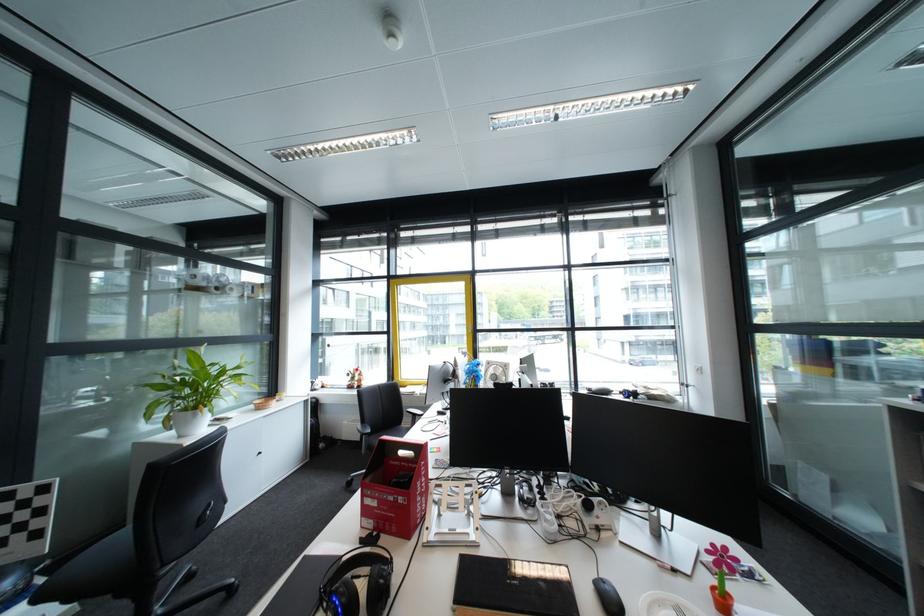
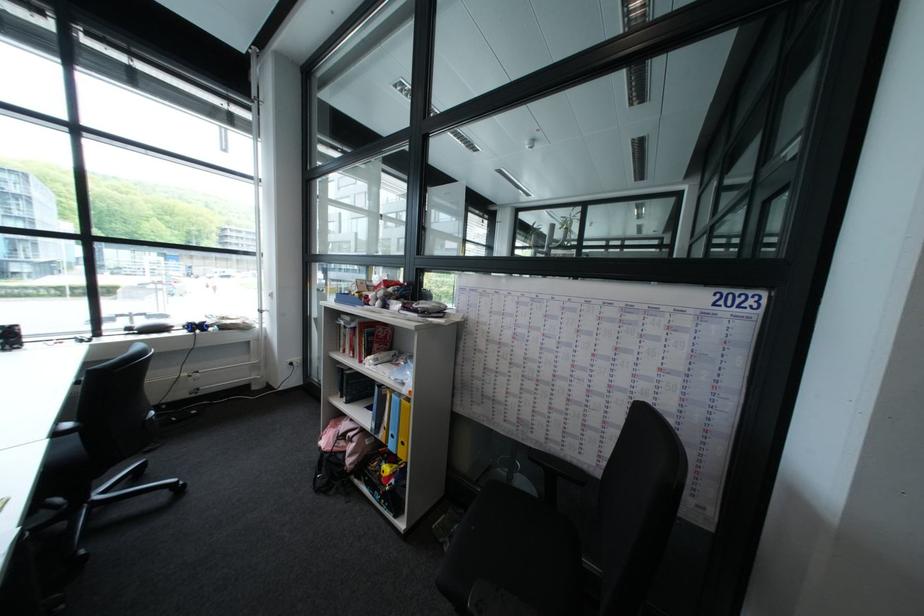
In the second image, find the point that corresponds to point 639,389 in the first image.

(203, 322)